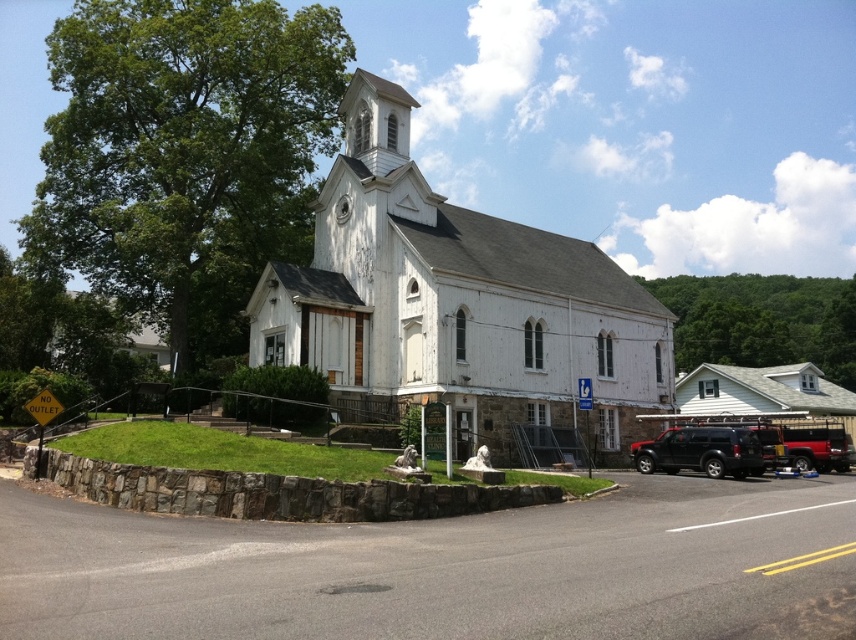
Question: Is white wooden church at center smaller than metallic red suv at lower right?

Choices:
 (A) no
 (B) yes

Answer: (A)

Question: Which is farther from the white wooden church at center?

Choices:
 (A) black matte suv at lower right
 (B) metallic red suv at lower right

Answer: (B)

Question: Estimate the real-world distances between objects in this image. Which object is closer to the metallic red suv at lower right?

Choices:
 (A) white wooden church at center
 (B) black matte suv at lower right

Answer: (B)

Question: Is white wooden church at center thinner than metallic red suv at lower right?

Choices:
 (A) yes
 (B) no

Answer: (B)

Question: Estimate the real-world distances between objects in this image. Which object is farther from the white wooden church at center?

Choices:
 (A) metallic red suv at lower right
 (B) black matte suv at lower right

Answer: (A)

Question: Observing the image, what is the correct spatial positioning of white wooden church at center in reference to black matte suv at lower right?

Choices:
 (A) below
 (B) above

Answer: (B)